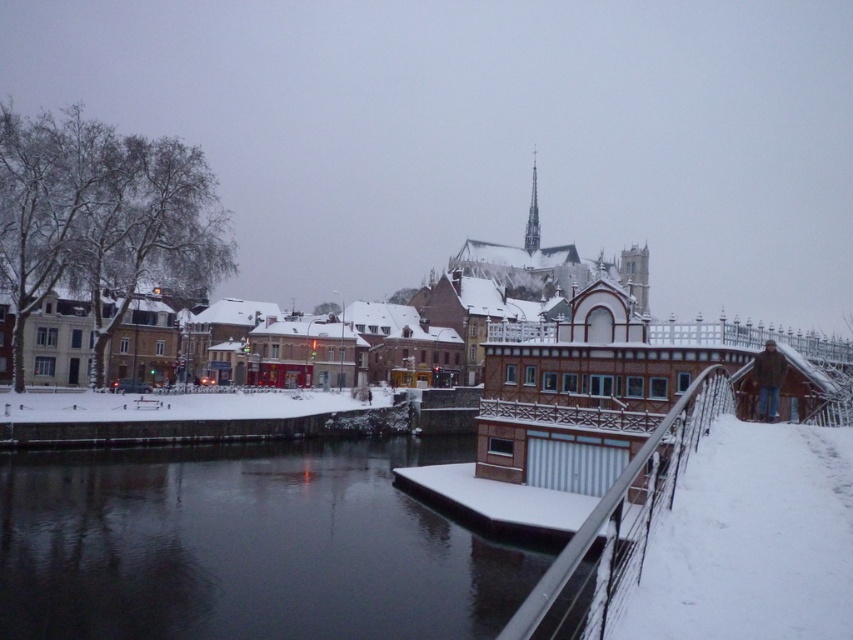
You are a photographer planning to capture a wide shot of the black water at center and the metallic silver rail at right. Based on their positions, which object should you focus on first to ensure both are in frame?

Since the black water at center might be wider than metallic silver rail at right, you should focus on the black water at center first to ensure both fit within the frame.

You are standing at the point with coordinates point [531,220] and want to walk towards the bridge. There is an obstacle at point [636,529]. Can you safely walk around it without crossing the obstacle?

Point [636,529] is in front of point [531,220], so you cannot safely walk around the obstacle without crossing it.

You are standing at the point with coordinates (247,547) in the winter scene. What do you see at that exact location?

At point (247,547) lies black water at center.